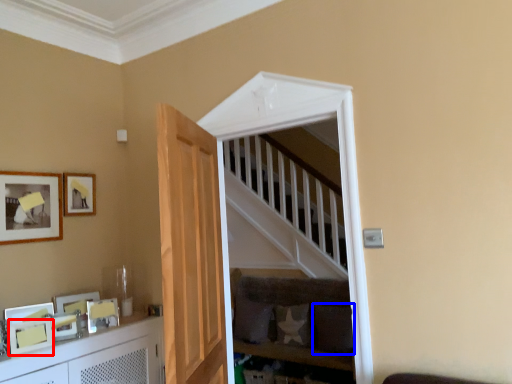
Question: Which of the following is the farthest to the observer, picture frame (highlighted by a red box) or pillow (highlighted by a blue box)?

Choices:
 (A) picture frame
 (B) pillow

Answer: (B)